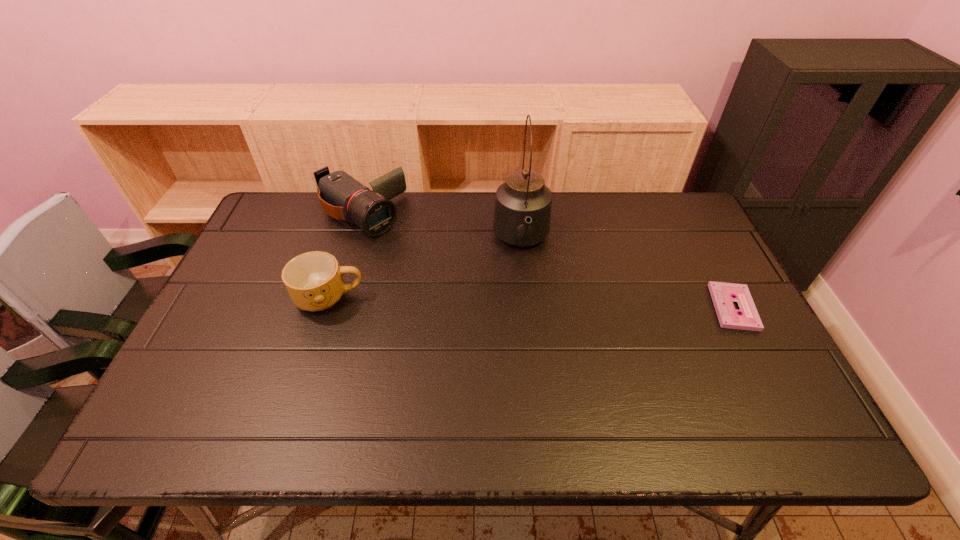
Locate an element on the screen. This screenshot has width=960, height=540. free space on the desktop that is between the second shortest object and the shortest object and is positioned on the lens of the camcorder is located at coordinates 472,301.

This screenshot has height=540, width=960. In order to click on free space on the desktop that is between the second shortest object and the shortest object and is positioned spout on the kettle in this screenshot , I will do `click(528, 302)`.